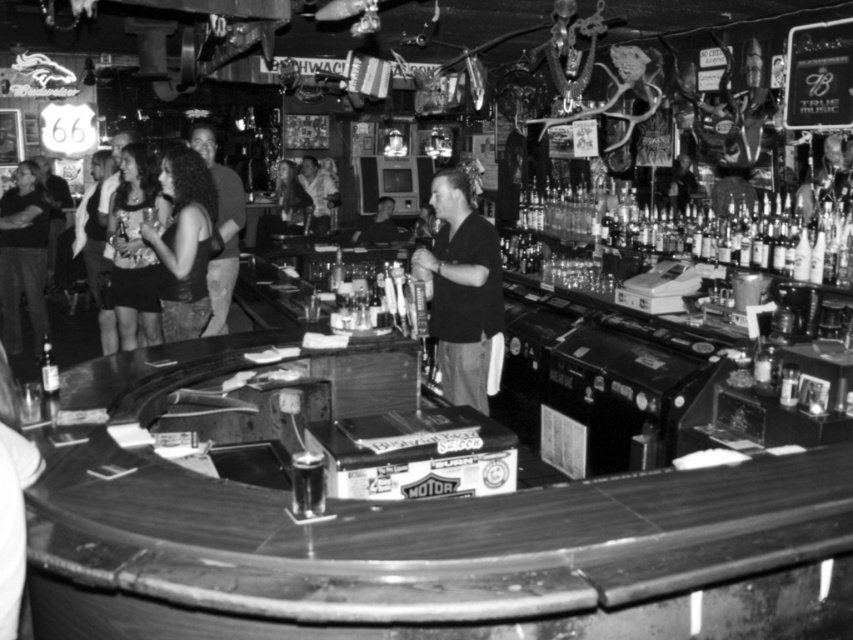
Can you confirm if matte black dress at left is shorter than clear glass bottle at bar left?

No, matte black dress at left is not shorter than clear glass bottle at bar left.

Is matte black dress at left wider than clear glass bottle at bar left?

Yes.

Is point (107, 237) closer to camera compared to point (42, 364)?

No, (107, 237) is behind (42, 364).

The image size is (853, 640). Find the location of `matte black dress at left`. matte black dress at left is located at coordinates (135, 248).

Is matte black dress at left positioned behind dark hair at left?

No, matte black dress at left is closer to the viewer.

Between matte black dress at left and dark hair at left, which one has more height?

Standing taller between the two is dark hair at left.

Which is behind, point (108, 234) or point (27, 269)?

Point (27, 269)

Locate an element on the screen. The width and height of the screenshot is (853, 640). matte black dress at left is located at coordinates (135, 248).

At what (x,y) coordinates should I click in order to perform the action: click on dark brown leather jacket at center. Please return your answer as a coordinate pair (x, y). Looking at the image, I should click on (184, 243).

Image resolution: width=853 pixels, height=640 pixels. What do you see at coordinates (184, 243) in the screenshot?
I see `dark brown leather jacket at center` at bounding box center [184, 243].

You are a GUI agent. You are given a task and a screenshot of the screen. Output one action in this format:
    pyautogui.click(x=<x>, y=<y>)
    Task: Click on the dark brown leather jacket at center
    The width and height of the screenshot is (853, 640).
    Given the screenshot: What is the action you would take?
    pyautogui.click(x=184, y=243)